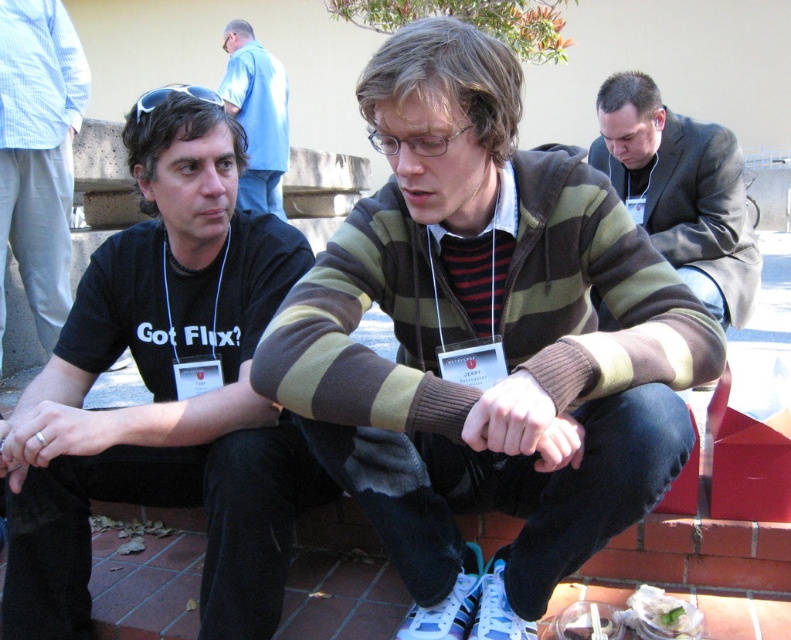
Looking at this image, is striped sweater at center taller than dark gray suit at center?

Yes, striped sweater at center is taller than dark gray suit at center.

Does point (561, 499) lie behind point (684, 184)?

No, (561, 499) is closer to viewer.

Where is `striped sweater at center`? Image resolution: width=791 pixels, height=640 pixels. striped sweater at center is located at coordinates (487, 332).

Does black cotton t-shirt at left appear under blue suede shoe at lower center?

No, black cotton t-shirt at left is not below blue suede shoe at lower center.

Who is taller, black cotton t-shirt at left or blue suede shoe at lower center?

black cotton t-shirt at left is taller.

The height and width of the screenshot is (640, 791). Identify the location of black cotton t-shirt at left. (38, 154).

Which of these two, blue suede shoe at lower center or translucent plastic bag at lower center, stands taller?

Standing taller between the two is blue suede shoe at lower center.

Between blue suede shoe at lower center and translucent plastic bag at lower center, which one is positioned higher?

Positioned higher is blue suede shoe at lower center.

Who is more forward, (438, 612) or (589, 602)?

Point (438, 612) is in front.

This screenshot has height=640, width=791. Identify the location of blue suede shoe at lower center. (448, 605).